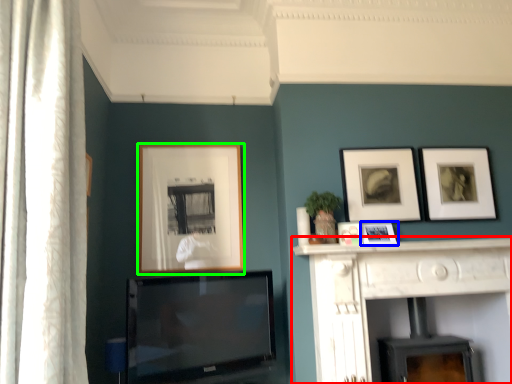
Question: Estimate the real-world distances between objects in this image. Which object is closer to fireplace (highlighted by a red box), picture frame (highlighted by a blue box) or picture frame (highlighted by a green box)?

Choices:
 (A) picture frame
 (B) picture frame

Answer: (A)